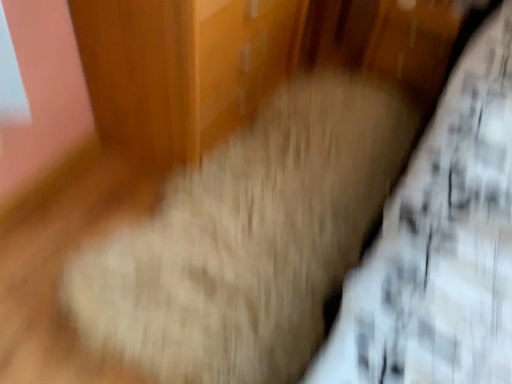
Describe the element at coordinates (182, 68) in the screenshot. I see `wooden dresser at center` at that location.

At what (x,y) coordinates should I click in order to perform the action: click on wooden dresser at center. Please return your answer as a coordinate pair (x, y). This screenshot has width=512, height=384. Looking at the image, I should click on (182, 68).

At what (x,y) coordinates should I click in order to perform the action: click on wooden dresser at center. Please return your answer as a coordinate pair (x, y). The width and height of the screenshot is (512, 384). Looking at the image, I should click on (182, 68).